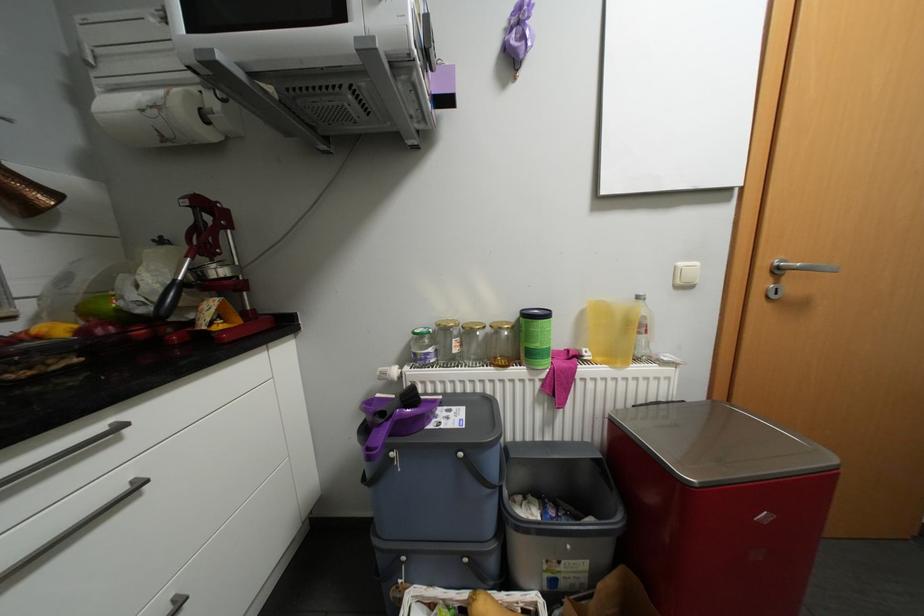
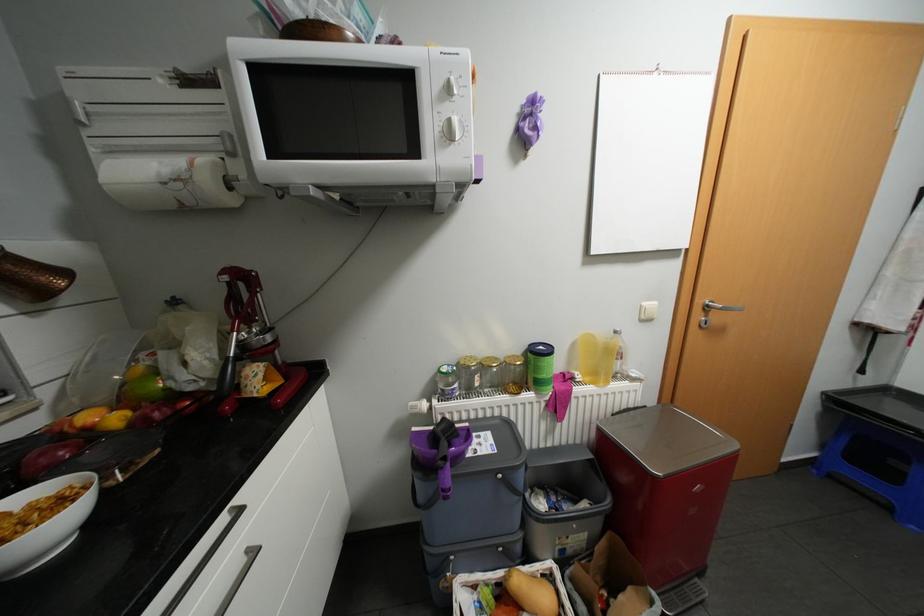
Find the pixel in the second image that matches point 216,134 in the first image.

(239, 199)